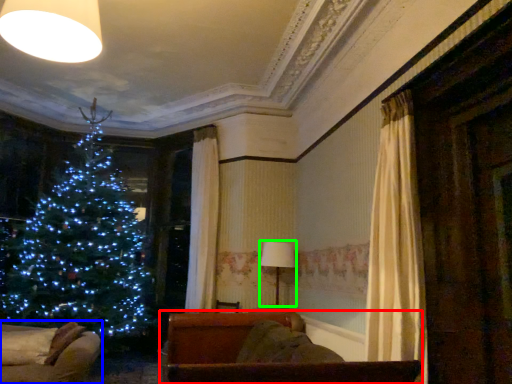
Question: Which object is the closest to the furniture (highlighted by a red box)? Choose among these: furniture (highlighted by a blue box) or lamp (highlighted by a green box).

Choices:
 (A) furniture
 (B) lamp

Answer: (A)